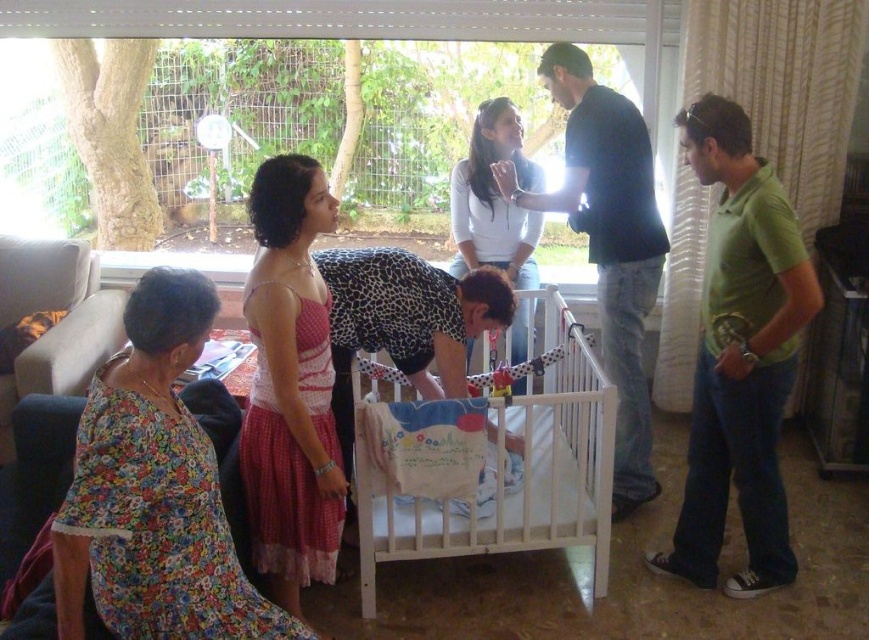
You are a photographer setting up a shot of the scene. You need to ensure that the green cotton shirt at right and the white wooden crib at center are both in focus. Which object should you adjust your camera focus to first to ensure both are sharp?

The green cotton shirt at right is located above the white wooden crib at center, so you should focus on the green cotton shirt at right first to ensure both are in focus since it is farther away.

You are a photographer positioned in the room and want to capture a photo that includes both the dark blue shirt at center and the white matte shirt at upper center. Based on their positions, which person should be placed closer to the camera to ensure both are in focus?

The dark blue shirt at center has a greater height compared to white matte shirt at upper center, so to ensure both are in focus, the person wearing the dark blue shirt at center should be positioned closer to the camera since they are taller and need to be within the same focal plane as the shorter individual.